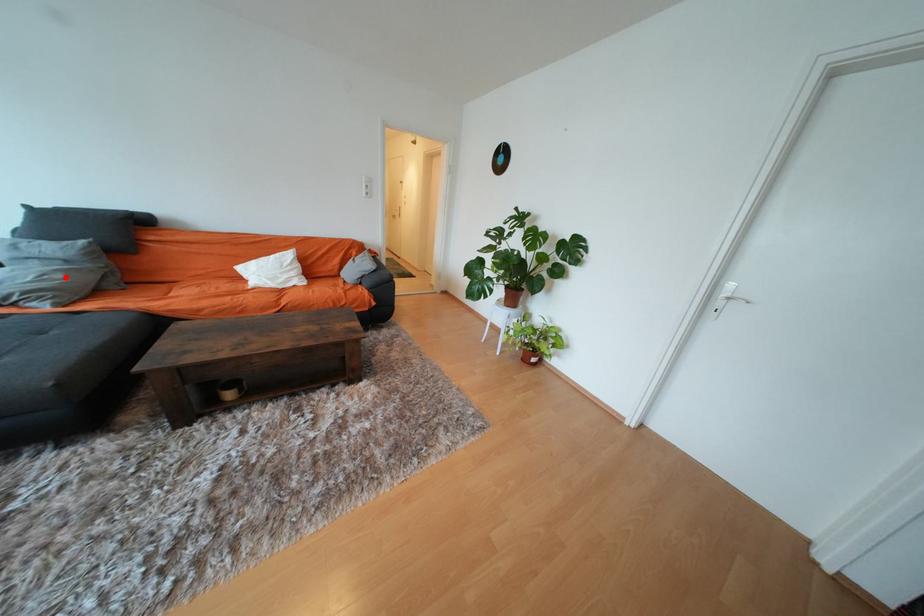
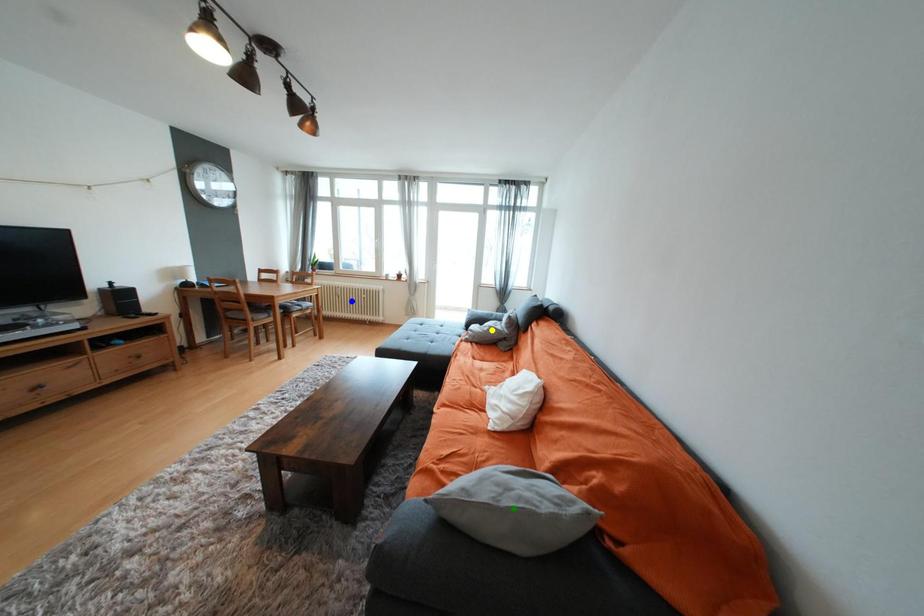
Question: I am providing you with two images of the same scene from different viewpoints. A red point is marked on the first image. You are given multiple points on the second image. Which point in image 2 is actually the same real-world point as the red point in image 1?

Choices:
 (A) green point
 (B) yellow point
 (C) blue point

Answer: (B)